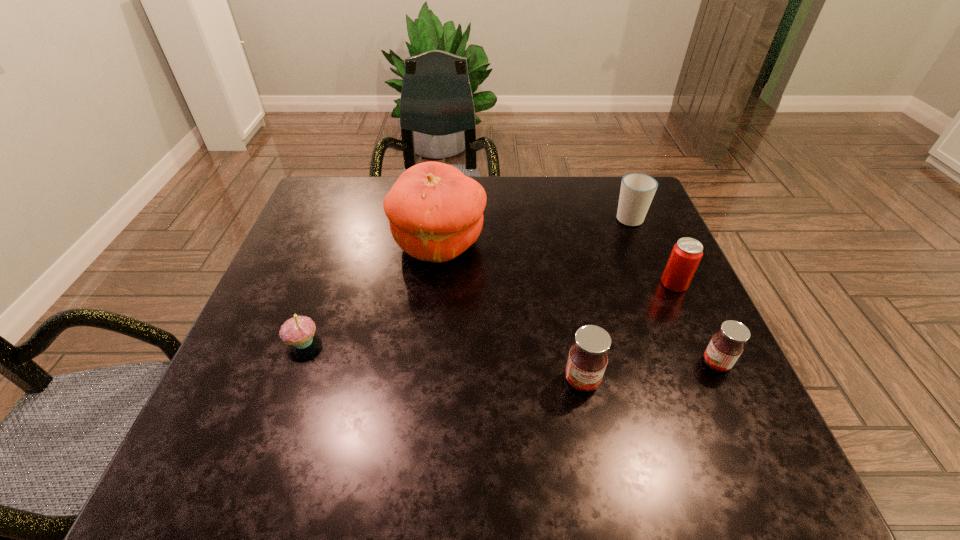
Please point out where to position a new jam on the left to maintain spacing. Please provide its 2D coordinates. Your answer should be formatted as a tuple, i.e. [(x, y)], where the tuple contains the x and y coordinates of a point satisfying the conditions above.

[(439, 398)]